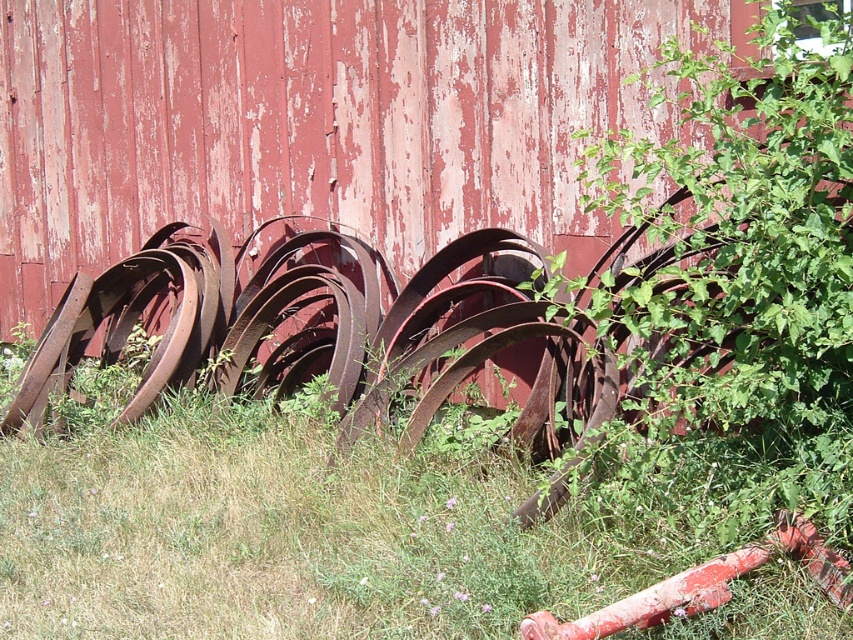
Question: Does green grass at lower left appear on the left side of green leafy plant at right?

Choices:
 (A) no
 (B) yes

Answer: (B)

Question: Which object appears farthest from the camera in this image?

Choices:
 (A) green leafy plant at right
 (B) green grass at lower left

Answer: (B)

Question: Is green grass at lower left positioned at the back of green leafy plant at right?

Choices:
 (A) no
 (B) yes

Answer: (B)

Question: Does green grass at lower left appear on the right side of green leafy plant at right?

Choices:
 (A) yes
 (B) no

Answer: (B)